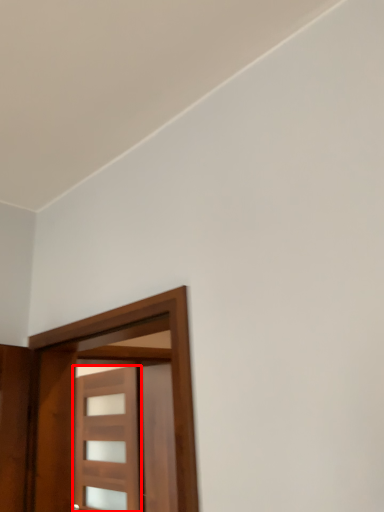
Question: From the image's perspective, considering the relative positions of door (annotated by the red box) and door in the image provided, where is door (annotated by the red box) located with respect to the staircase?

Choices:
 (A) below
 (B) above

Answer: (A)